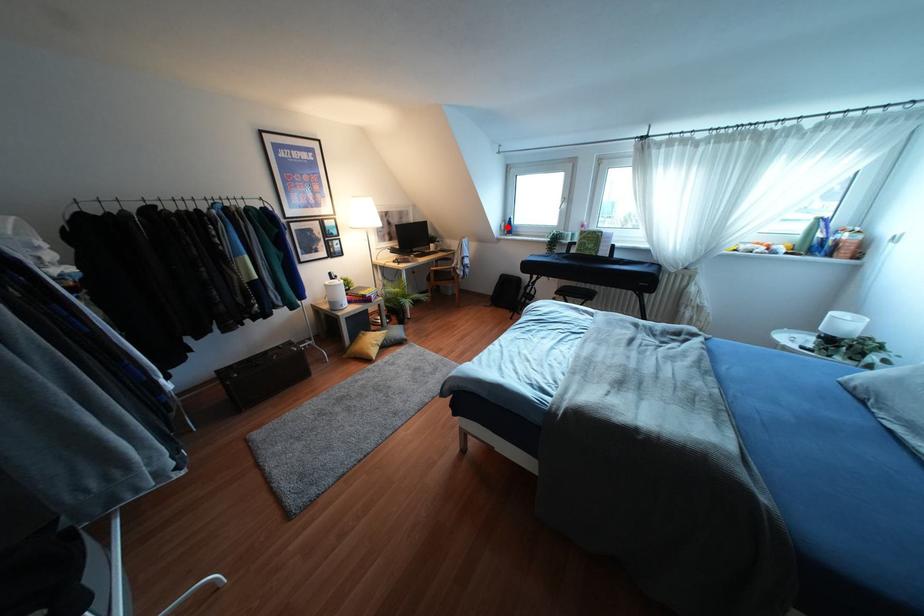
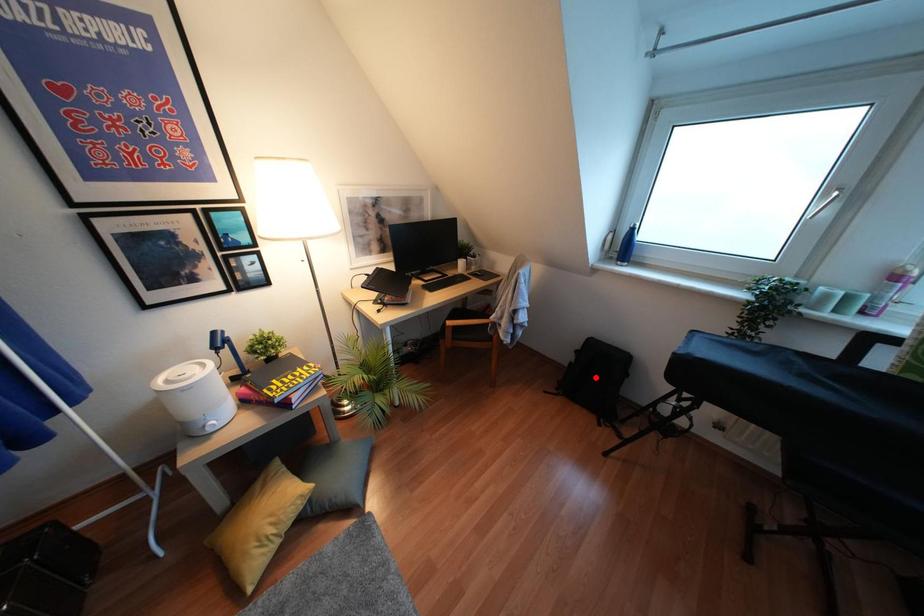
I am providing you with two images of the same scene from different viewpoints. A red point is marked on the first image and another point is marked on the second image. Do the highlighted points in image1 and image2 indicate the same real-world spot?

No